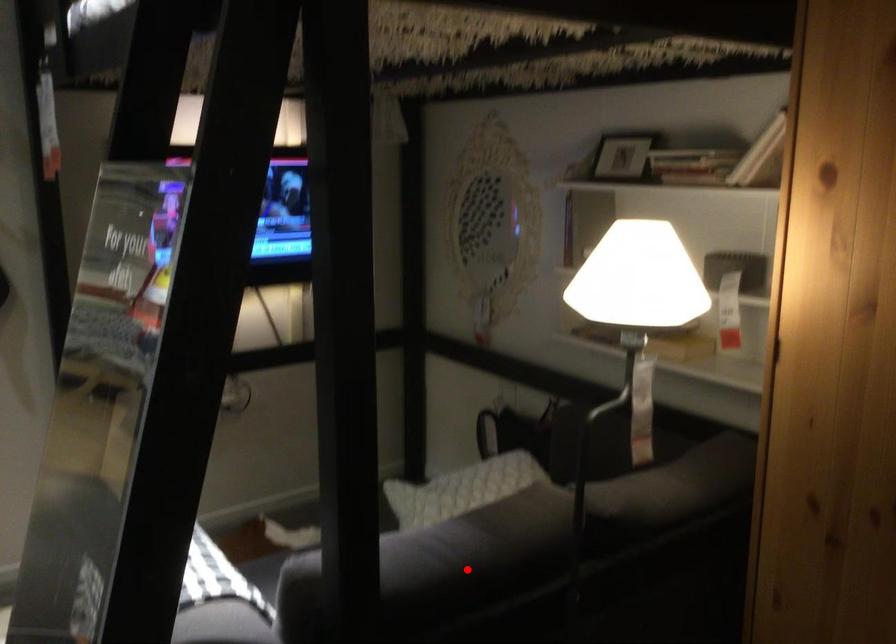
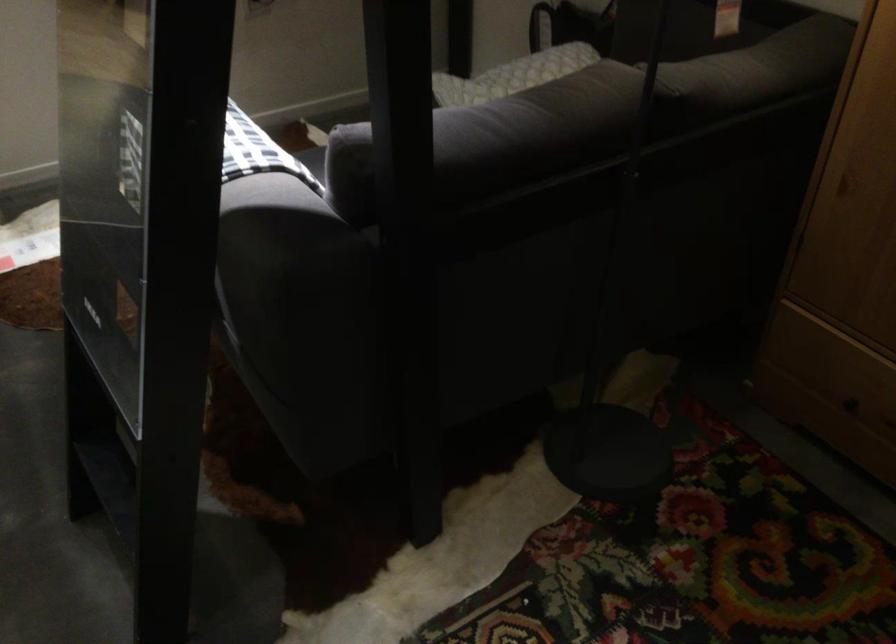
In the second image, find the point that corresponds to the highlighted location in the first image.

(519, 140)